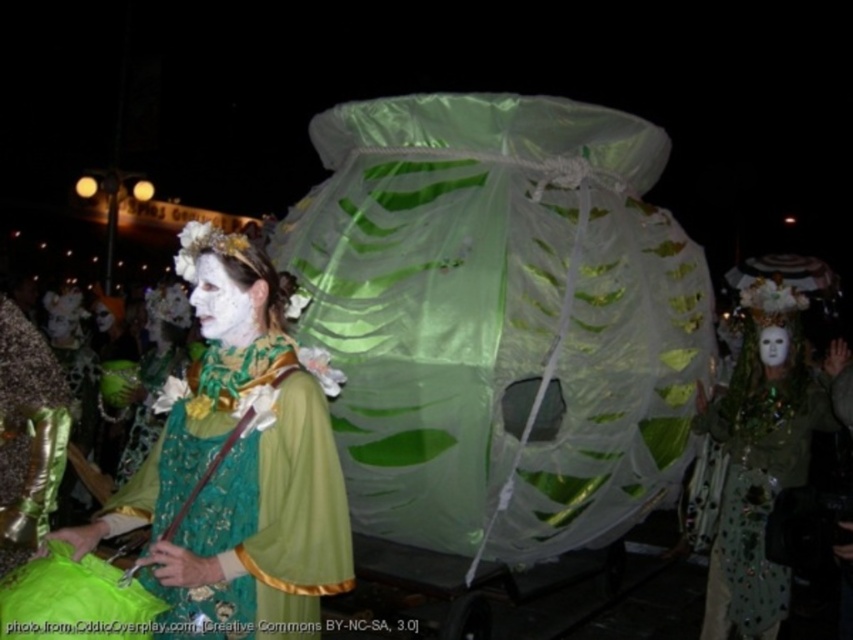
You are a photographer at the event and want to capture a clear photo of the white matte face at center without the green lace dress at center blocking it. Is this possible?

The green lace dress at center is in front of the white matte face at center, so it will block the view. To capture the white matte face at center clearly, you need to adjust your angle or move closer to avoid the dress.

You are a photographer at the parade who wants to capture both the white matte face at center and the white matte mask at center in a single photo. Since you can only focus on one subject, which one should you choose to ensure both are visible in the frame?

Since the white matte face at center is to the left of the white matte mask at center, you should focus on the white matte face at center to ensure both are visible in the frame.